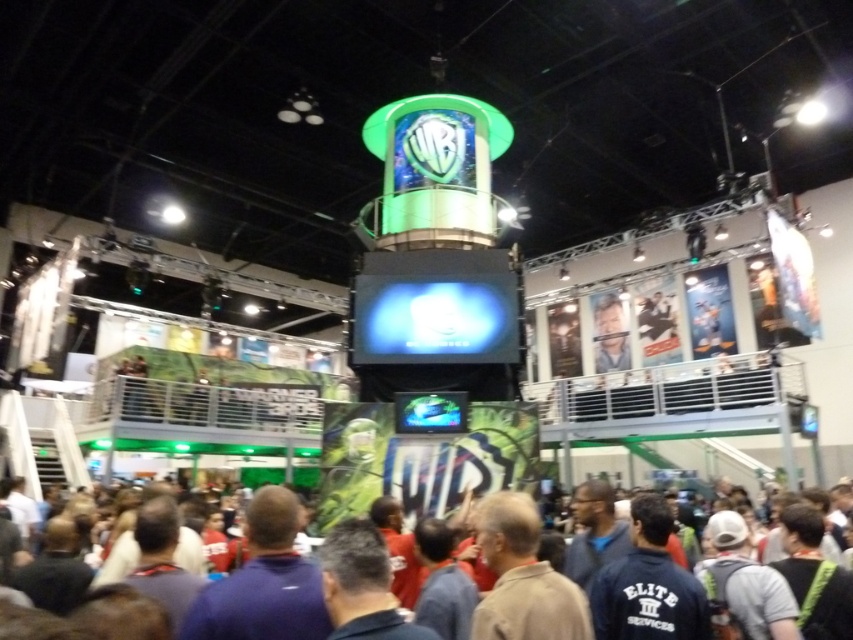
Question: Does brown fabric shirt at lower center have a lesser width compared to light blue shirt at center?

Choices:
 (A) yes
 (B) no

Answer: (B)

Question: Can you confirm if brown fabric shirt at lower center is positioned below light blue shirt at center?

Choices:
 (A) no
 (B) yes

Answer: (B)

Question: Can you confirm if brown fabric shirt at lower center is positioned to the left of light blue shirt at center?

Choices:
 (A) yes
 (B) no

Answer: (A)